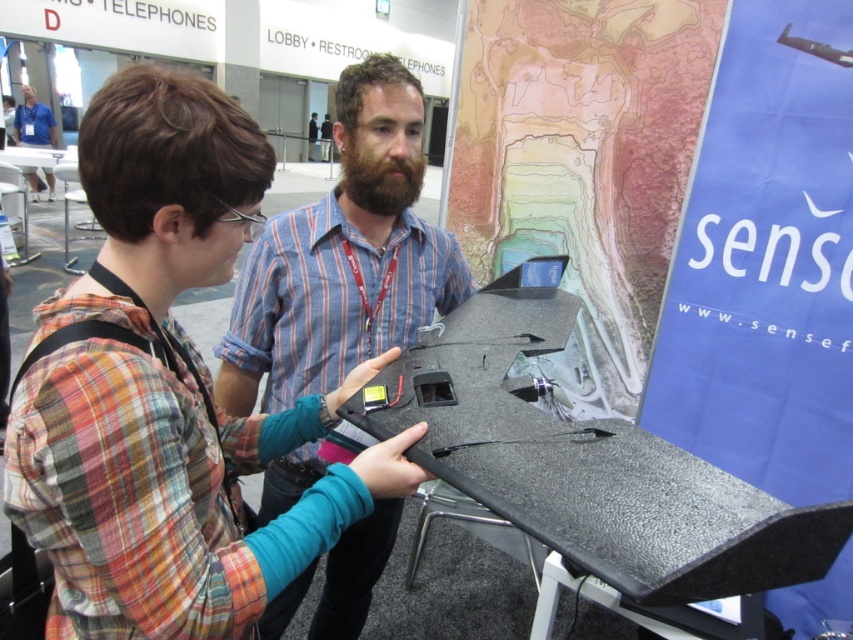
You are attending a tech exhibition and notice two people in the scene. The plaid shirt at center and the matte blue shirt at upper left are both present. Which of these individuals is positioned lower in the image?

The plaid shirt at center is located below the matte blue shirt at upper left, so the plaid shirt at center is positioned lower in the image.

You are a photographer at the event and want to capture a clear photo of the matte blue shirt at center without the matte blue shirt at upper left blocking it. Based on their positions, can you position yourself in a way to achieve this?

Yes, since the matte blue shirt at center is in front of the matte blue shirt at upper left, positioning yourself so that the matte blue shirt at center is between you and the matte blue shirt at upper left would allow you to capture a clear photo without obstruction.